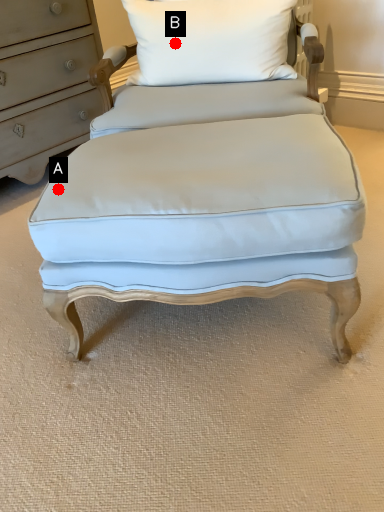
Question: Two points are circled on the image, labeled by A and B beside each circle. Which point is closer to the camera?

Choices:
 (A) A is closer
 (B) B is closer

Answer: (A)